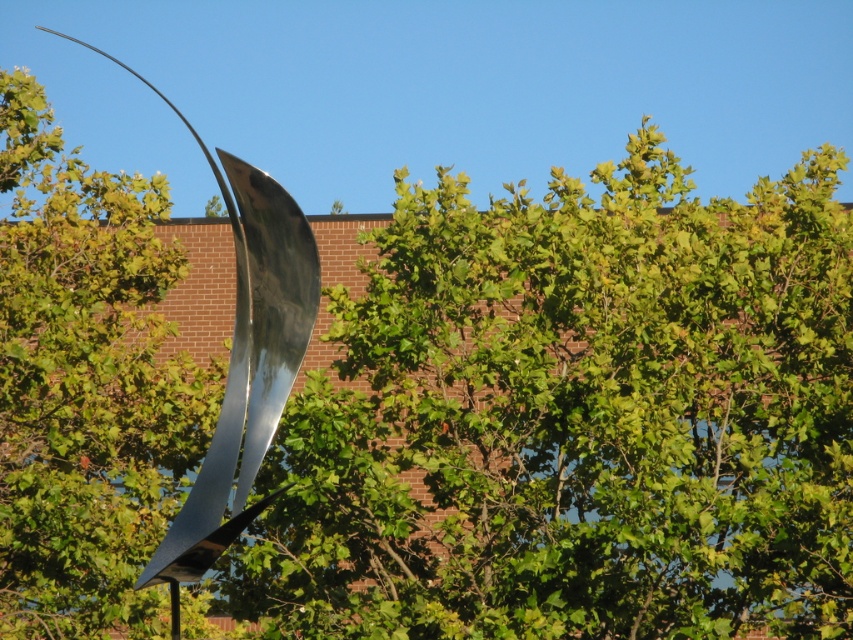
You are an artist planning to paint the scene. You want to ensure the green leafy tree at center and the shiny metallic sculpture at left are proportionally accurate. Which object should you draw taller in your painting?

The shiny metallic sculpture at left is taller than the green leafy tree at center, so you should draw the shiny metallic sculpture at left taller in your painting.

You are standing in front of the metallic sculpture and want to take a photo of the green leafy tree at center. Based on its position, which direction should you face to capture it in your shot?

The green leafy tree at center is located at point [576,419], which means it is positioned to the right and slightly above the center of the image. To capture it in your photo, you should face towards the right side of the sculpture and look slightly upward.

You are standing at the point marked as point (576, 419). What can you see directly in front of you?

At point (576, 419), you can see a green leafy tree at center directly in front of you.